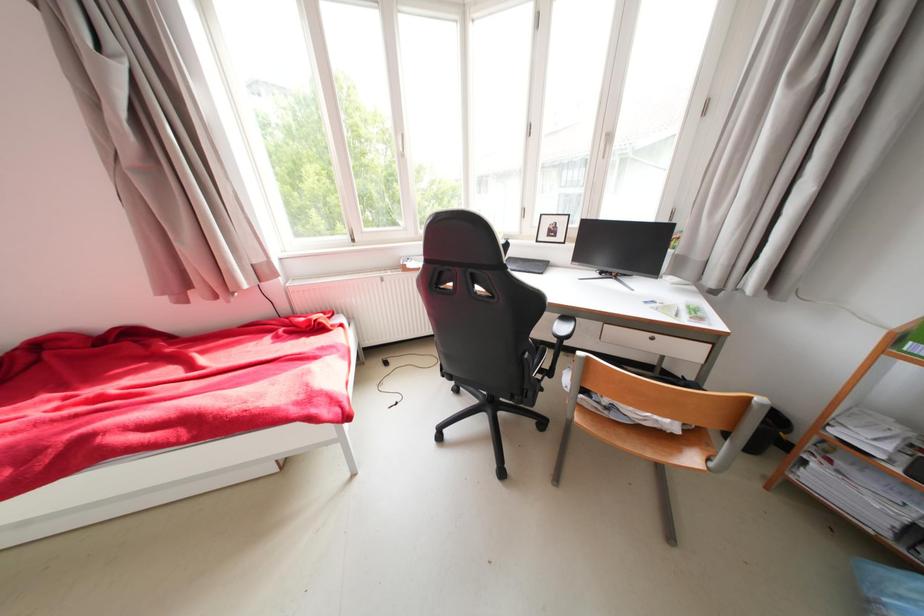
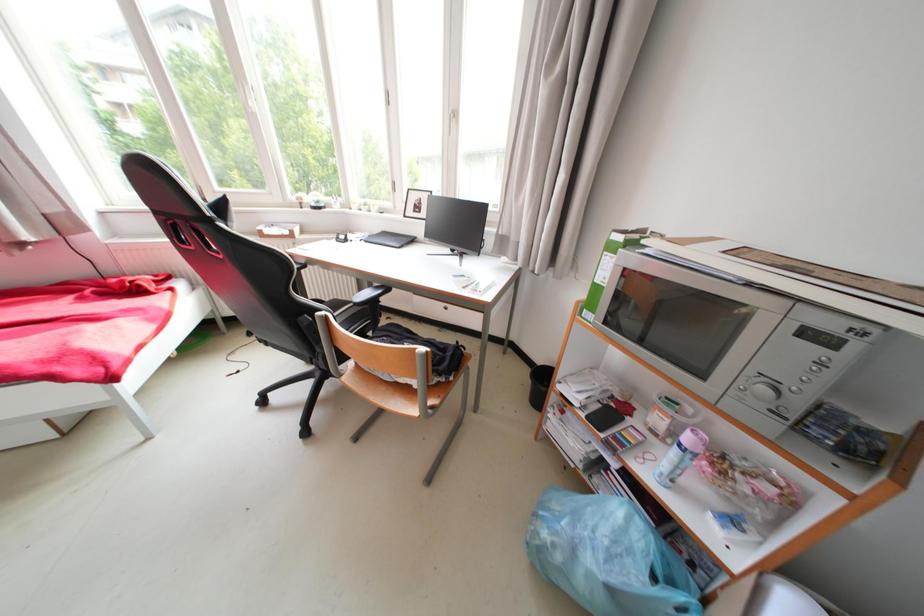
Question: Which direction would the cameraman need to move to produce the second image? Reply with the corresponding letter.

Choices:
 (A) Left
 (B) Right
 (C) Forward
 (D) Backward

Answer: (B)